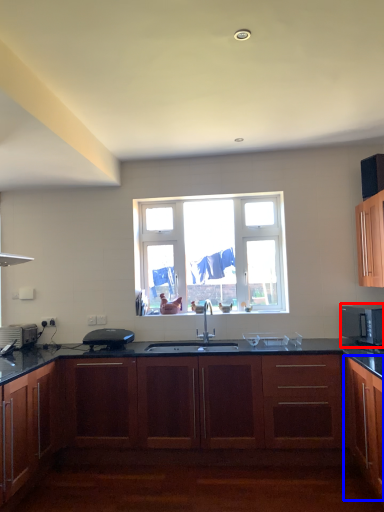
Question: Among these objects, which one is nearest to the camera, microwave oven (highlighted by a red box) or cabinetry (highlighted by a blue box)?

Choices:
 (A) microwave oven
 (B) cabinetry

Answer: (B)